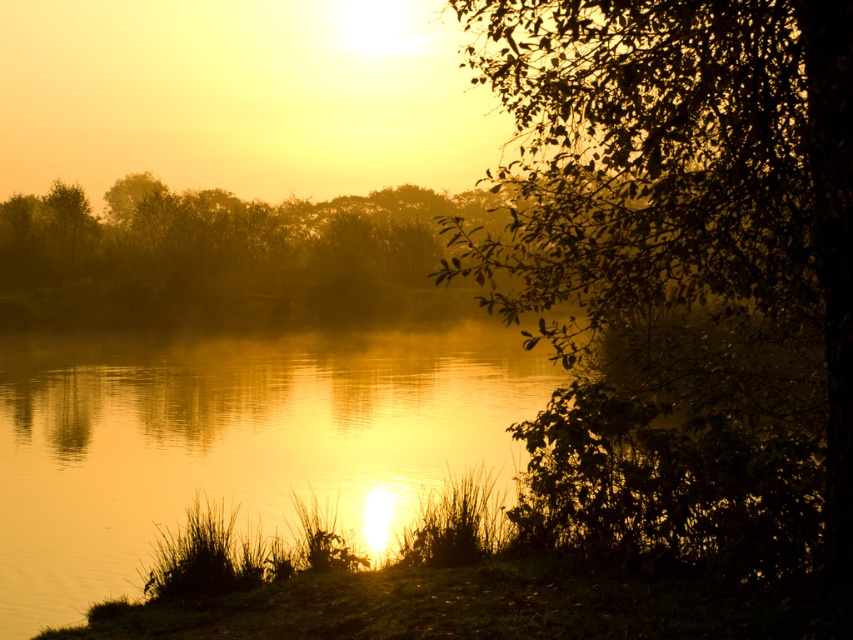
You are an artist planning to paint the scene. You want to ensure the green leafy tree at right and golden reflective water at center are proportionally accurate. Which object should you make thinner in your painting?

The green leafy tree at right should be made thinner than the golden reflective water at center in the painting to maintain proportional accuracy.

You are standing on the grassy bank and want to walk towards the golden reflective water at center. Is the green leafy tree at right between you and the water?

The green leafy tree at right is closer to the viewer than the golden reflective water at center, so yes, the tree is between you and the water.